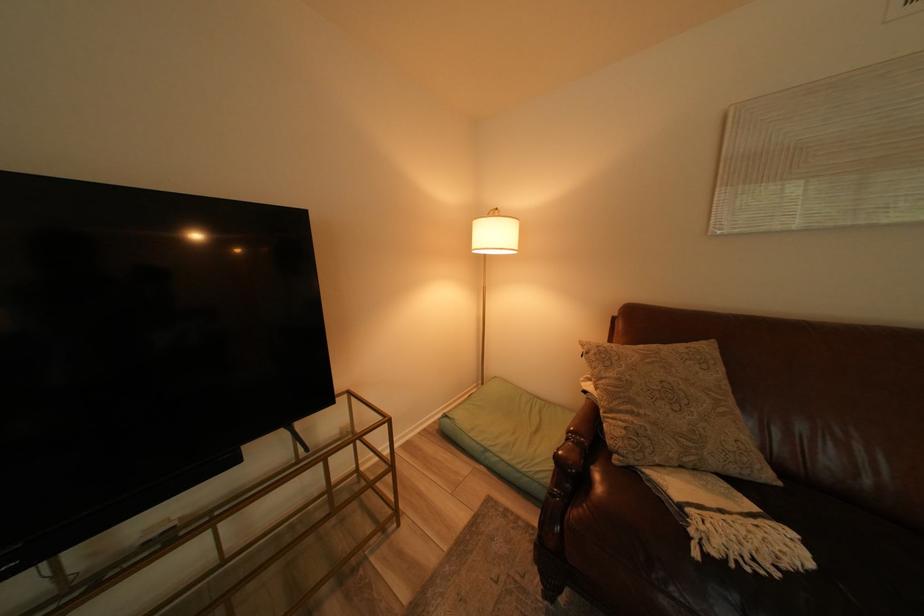
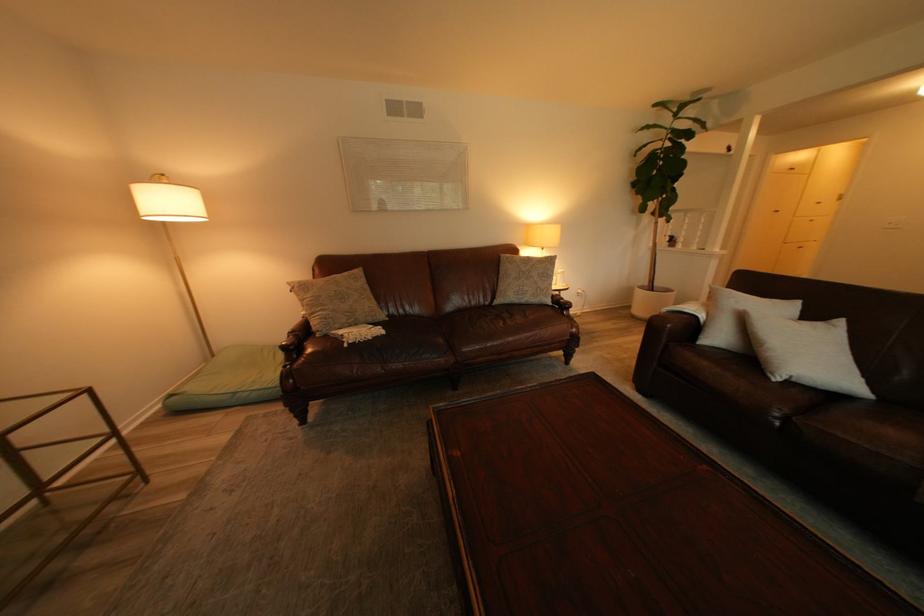
In the second image, find the point that corresponds to point (750, 562) in the first image.

(372, 342)